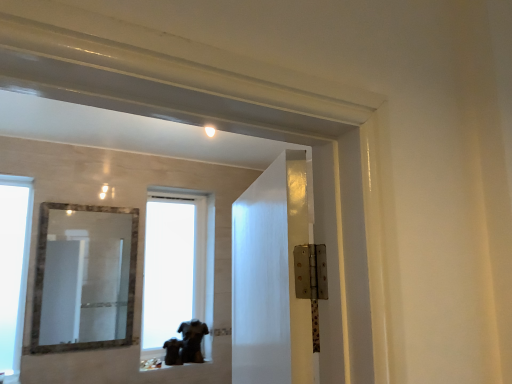
Question: Choose the correct answer: Is transparent glass window at left, which appears as the first window when viewed from the front, inside velvety black shirt at lower center or outside it?

Choices:
 (A) outside
 (B) inside

Answer: (A)

Question: Based on their sizes in the image, would you say transparent glass window at left, acting as the 2th window starting from the back, is bigger or smaller than velvety black shirt at lower center?

Choices:
 (A) small
 (B) big

Answer: (B)

Question: Considering the real-world distances, which object is closest to the transparent glass window at left, acting as the 2th window starting from the back?

Choices:
 (A) marble-framed mirror at center
 (B) velvety black shirt at lower center
 (C) transparent glass window at center, which is the 1th window from right to left

Answer: (B)

Question: Estimate the real-world distances between objects in this image. Which object is farther from the marble-framed mirror at center?

Choices:
 (A) transparent glass window at left, acting as the 2th window starting from the back
 (B) velvety black shirt at lower center
 (C) transparent glass window at center, which is the 1th window from right to left

Answer: (B)